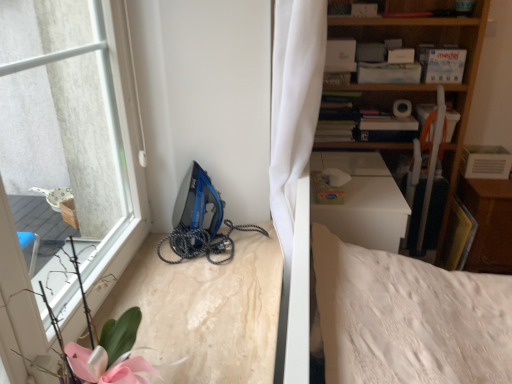
Question: Does wooden bookshelf at upper right contain wooden dresser at right?

Choices:
 (A) yes
 (B) no

Answer: (B)

Question: Is wooden bookshelf at upper right smaller than wooden dresser at right?

Choices:
 (A) yes
 (B) no

Answer: (B)

Question: Can you confirm if wooden bookshelf at upper right is positioned to the right of wooden dresser at right?

Choices:
 (A) no
 (B) yes

Answer: (A)

Question: Does wooden bookshelf at upper right lie in front of wooden dresser at right?

Choices:
 (A) no
 (B) yes

Answer: (B)

Question: Is wooden bookshelf at upper right far from wooden dresser at right?

Choices:
 (A) no
 (B) yes

Answer: (A)

Question: Based on their positions, is wooden bookshelf at upper right located to the left or right of wooden dresser at right?

Choices:
 (A) right
 (B) left

Answer: (B)

Question: Would you say wooden bookshelf at upper right is inside or outside wooden dresser at right?

Choices:
 (A) outside
 (B) inside

Answer: (A)

Question: In the image, is wooden bookshelf at upper right positioned in front of or behind wooden dresser at right?

Choices:
 (A) front
 (B) behind

Answer: (A)

Question: Looking at the image, does wooden bookshelf at upper right seem bigger or smaller compared to wooden dresser at right?

Choices:
 (A) small
 (B) big

Answer: (B)

Question: From the image's perspective, is wooden bookshelf at upper right positioned above or below blue plastic iron at lower left?

Choices:
 (A) above
 (B) below

Answer: (A)

Question: Considering their positions, is wooden bookshelf at upper right located in front of or behind blue plastic iron at lower left?

Choices:
 (A) behind
 (B) front

Answer: (A)

Question: Looking at their shapes, would you say wooden bookshelf at upper right is wider or thinner than blue plastic iron at lower left?

Choices:
 (A) thin
 (B) wide

Answer: (B)

Question: Looking at the image, does wooden bookshelf at upper right seem bigger or smaller compared to blue plastic iron at lower left?

Choices:
 (A) small
 (B) big

Answer: (B)

Question: Is wooden dresser at right spatially inside wooden bookshelf at upper right, or outside of it?

Choices:
 (A) outside
 (B) inside

Answer: (A)

Question: Is point (475, 195) positioned closer to the camera than point (453, 192)?

Choices:
 (A) closer
 (B) farther

Answer: (A)